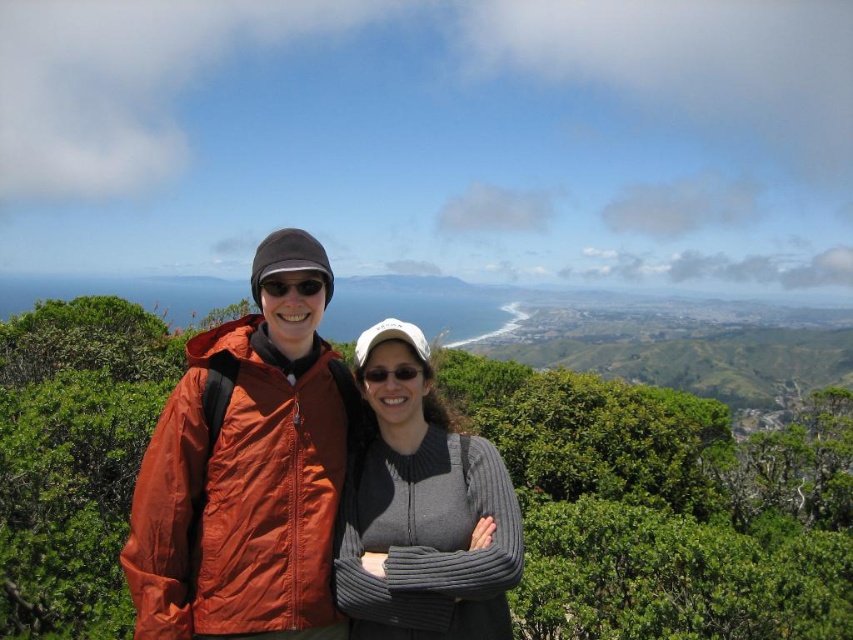
Question: Which of the following is the closest to the observer?

Choices:
 (A) (389, 376)
 (B) (277, 288)
 (C) (306, 252)
 (D) (352, 618)

Answer: (D)

Question: Can you confirm if gray ribbed sweater at center is thinner than sunglasses at center?

Choices:
 (A) yes
 (B) no

Answer: (B)

Question: Does gray ribbed sweater at center appear under sunglasses at center?

Choices:
 (A) no
 (B) yes

Answer: (B)

Question: Which point is closer to the camera?

Choices:
 (A) matte black sunglasses at center
 (B) sunglasses at center
 (C) gray ribbed sweater at center

Answer: (C)

Question: Which point is farther to the camera?

Choices:
 (A) (277, 291)
 (B) (389, 378)
 (C) (378, 520)
 (D) (364, 376)

Answer: (D)

Question: Does gray ribbed sweater at center appear under matte orange jacket at center?

Choices:
 (A) no
 (B) yes

Answer: (B)